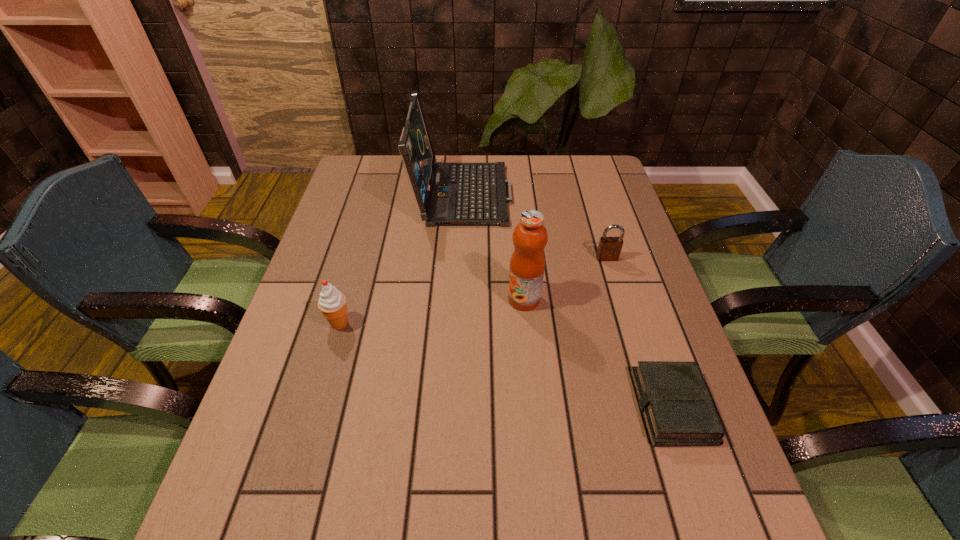
The image size is (960, 540). Find the location of `the farthest object`. the farthest object is located at coordinates (447, 193).

This screenshot has width=960, height=540. Identify the location of fruit juice. (527, 264).

Locate an element on the screen. The height and width of the screenshot is (540, 960). icecream is located at coordinates pyautogui.click(x=332, y=303).

Locate an element on the screen. Image resolution: width=960 pixels, height=540 pixels. the third tallest object is located at coordinates (332, 303).

The width and height of the screenshot is (960, 540). Find the location of `padlock`. padlock is located at coordinates (609, 248).

Identify the location of the second shortest object. [609, 248].

This screenshot has width=960, height=540. Identify the location of the nearest object. (678, 411).

The height and width of the screenshot is (540, 960). What are the coordinates of `book` in the screenshot? It's located at (678, 411).

The height and width of the screenshot is (540, 960). Find the location of `vacant space located on the front-facing side of the farthest object`. vacant space located on the front-facing side of the farthest object is located at coordinates (535, 191).

Where is `free space located on the front label of the third farthest object`? This screenshot has height=540, width=960. free space located on the front label of the third farthest object is located at coordinates (417, 299).